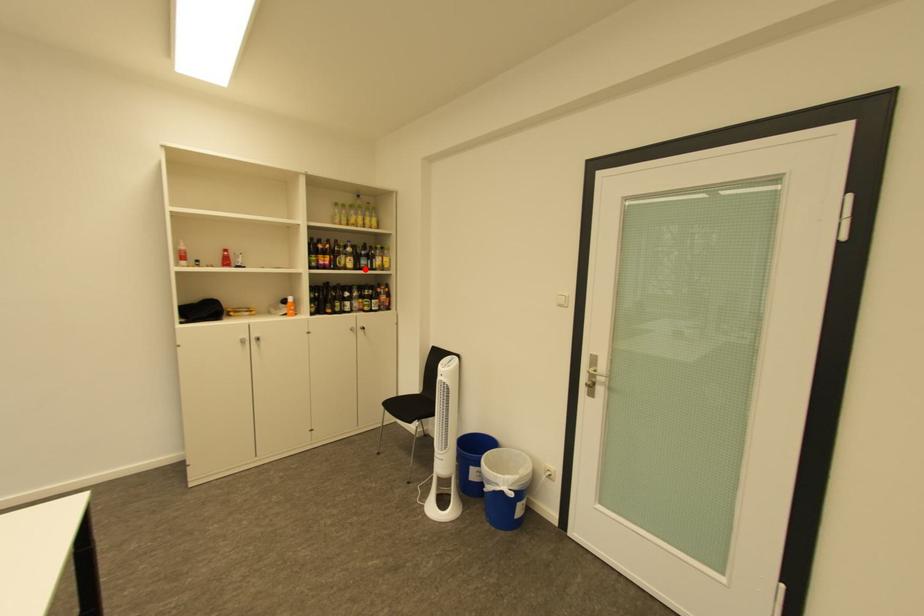
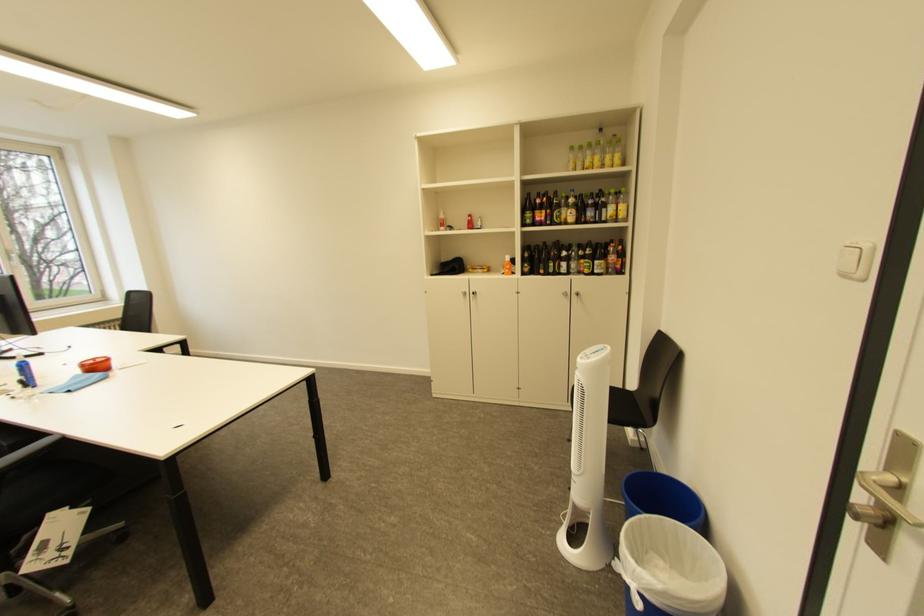
In the second image, find the point that corresponds to the highlighted location in the first image.

(587, 224)